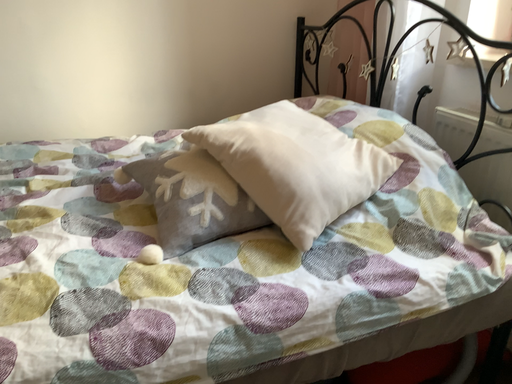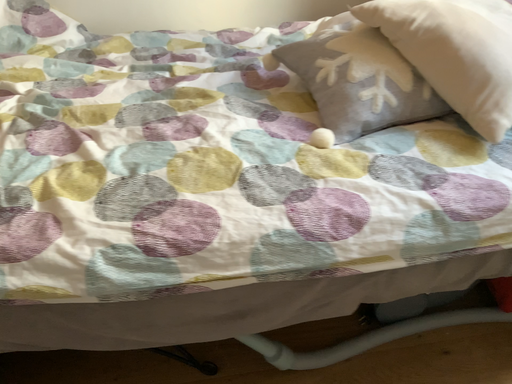
Question: How did the camera likely rotate when shooting the video?

Choices:
 (A) rotated upward
 (B) rotated downward

Answer: (B)